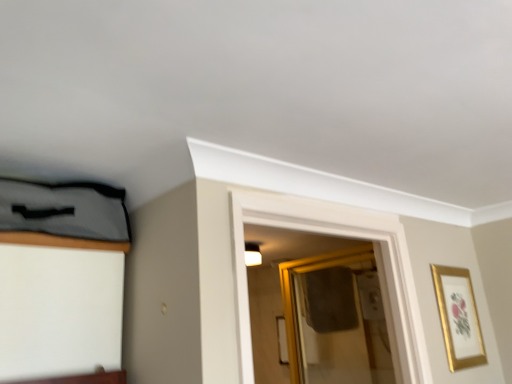
Question: Can you confirm if gold-framed mirror at center is smaller than gold metallic picture frame at upper right?

Choices:
 (A) no
 (B) yes

Answer: (A)

Question: From a real-world perspective, is gold-framed mirror at center physically below gold metallic picture frame at upper right?

Choices:
 (A) yes
 (B) no

Answer: (B)

Question: Can you confirm if gold-framed mirror at center is positioned to the right of gold metallic picture frame at upper right?

Choices:
 (A) no
 (B) yes

Answer: (A)

Question: Does gold-framed mirror at center come in front of gold metallic picture frame at upper right?

Choices:
 (A) no
 (B) yes

Answer: (A)

Question: Can you confirm if gold-framed mirror at center is bigger than gold metallic picture frame at upper right?

Choices:
 (A) yes
 (B) no

Answer: (A)

Question: Is gold-framed mirror at center at the left side of gold metallic picture frame at upper right?

Choices:
 (A) yes
 (B) no

Answer: (A)

Question: Is gold metallic picture frame at upper right taller than gold-framed mirror at center?

Choices:
 (A) yes
 (B) no

Answer: (B)

Question: From a real-world perspective, is gold metallic picture frame at upper right physically above gold-framed mirror at center?

Choices:
 (A) no
 (B) yes

Answer: (A)

Question: Does gold metallic picture frame at upper right appear on the left side of gold-framed mirror at center?

Choices:
 (A) yes
 (B) no

Answer: (B)

Question: Could gold-framed mirror at center be considered to be inside gold metallic picture frame at upper right?

Choices:
 (A) yes
 (B) no

Answer: (B)

Question: Is gold metallic picture frame at upper right outside gold-framed mirror at center?

Choices:
 (A) no
 (B) yes

Answer: (B)

Question: Considering the relative sizes of gold metallic picture frame at upper right and gold-framed mirror at center in the image provided, is gold metallic picture frame at upper right shorter than gold-framed mirror at center?

Choices:
 (A) yes
 (B) no

Answer: (A)

Question: Would you say gold metallic picture frame at upper right is to the left or to the right of gold-framed mirror at center in the picture?

Choices:
 (A) right
 (B) left

Answer: (A)